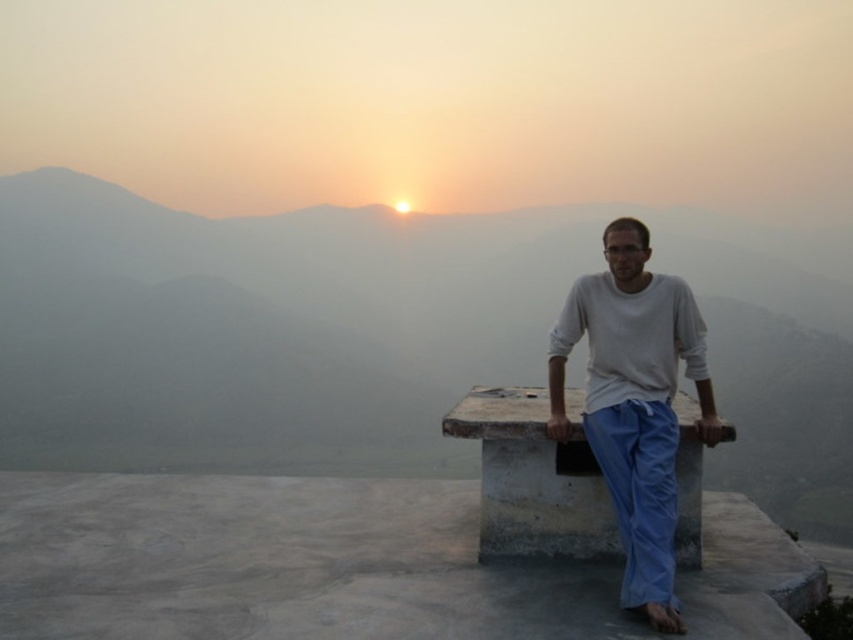
Which is above, gray stone bench at center or white cotton shirt at center?

Positioned higher is gray stone bench at center.

Can you confirm if gray stone bench at center is positioned below white cotton shirt at center?

Incorrect, gray stone bench at center is not positioned below white cotton shirt at center.

Between point (846, 324) and point (613, 392), which one is positioned behind?

The point (846, 324) is more distant.

You are a GUI agent. You are given a task and a screenshot of the screen. Output one action in this format:
    pyautogui.click(x=<x>, y=<y>)
    Task: Click on the gray stone bench at center
    This screenshot has height=640, width=853.
    Given the screenshot: What is the action you would take?
    pyautogui.click(x=259, y=320)

Is point (635, 333) positioned before point (680, 515)?

That is True.

I want to click on white cotton shirt at center, so click(634, 403).

Who is higher up, gray stone bench at center or concrete bench at center?

gray stone bench at center is higher up.

Between point (338, 211) and point (682, 529), which one is positioned behind?

The point (338, 211) is more distant.

Image resolution: width=853 pixels, height=640 pixels. Describe the element at coordinates (259, 320) in the screenshot. I see `gray stone bench at center` at that location.

Where is `gray stone bench at center`? gray stone bench at center is located at coordinates (259, 320).